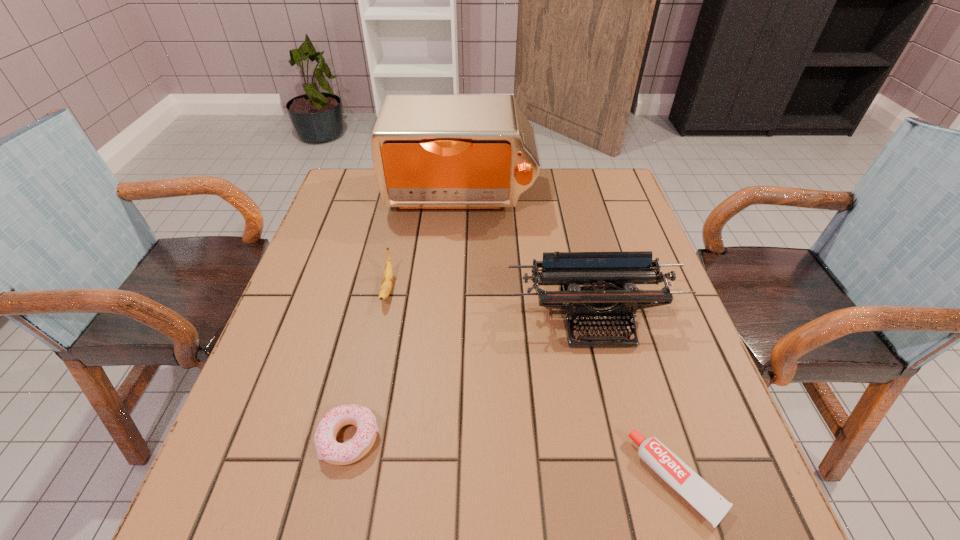
Locate an element on the screen. This screenshot has height=540, width=960. vacant space located on the left of the toothpaste is located at coordinates pyautogui.click(x=395, y=480).

Identify the location of object that is at the far edge. (478, 152).

This screenshot has width=960, height=540. In order to click on object located in the near edge section of the desktop in this screenshot , I will do `click(705, 499)`.

Where is `object that is at the left edge`? The image size is (960, 540). object that is at the left edge is located at coordinates (328, 449).

Find the location of a particular element. The width and height of the screenshot is (960, 540). typewriter that is at the right edge is located at coordinates (608, 278).

At what (x,y) coordinates should I click in order to perform the action: click on toothpaste at the right edge. Please return your answer as a coordinate pair (x, y). This screenshot has height=540, width=960. Looking at the image, I should click on (705, 499).

Identify the location of object that is at the near right corner. (705, 499).

In the image, there is a desktop. At what (x,y) coordinates should I click in order to perform the action: click on vacant space at the far edge. Please return your answer as a coordinate pair (x, y). The height and width of the screenshot is (540, 960). Looking at the image, I should click on (560, 170).

This screenshot has height=540, width=960. In order to click on vacant area at the near edge of the desktop in this screenshot , I will do `click(379, 532)`.

Where is `free location at the left edge`? free location at the left edge is located at coordinates (255, 433).